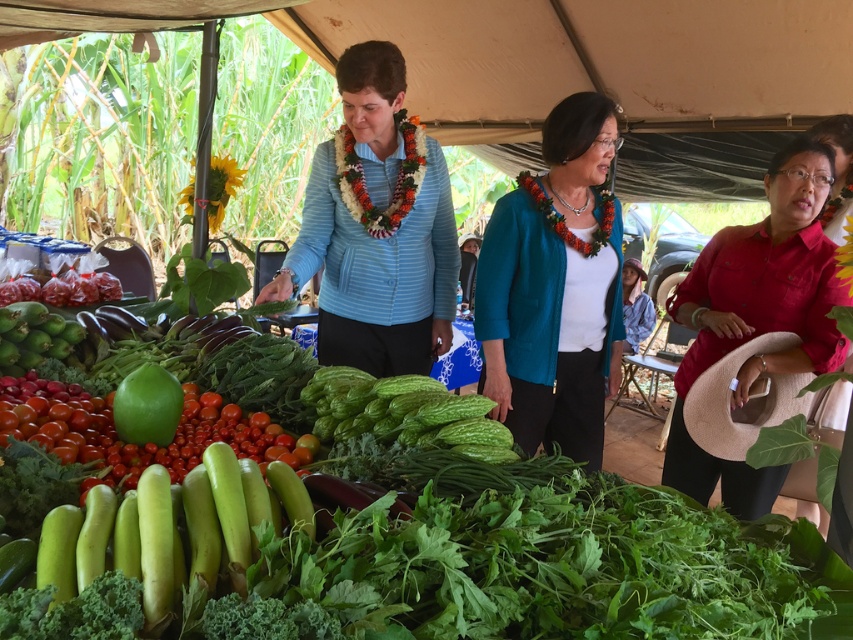
Question: Is red matte shirt at right below green matte melon at center?

Choices:
 (A) no
 (B) yes

Answer: (A)

Question: Which of the following is the farthest from the observer?

Choices:
 (A) red matte shirt at right
 (B) blue striped shirt at center
 (C) teal fabric jacket at center

Answer: (C)

Question: Among these objects, which one is farthest from the camera?

Choices:
 (A) teal fabric jacket at center
 (B) green matte melon at center

Answer: (A)

Question: Which is farther from the teal fabric jacket at center?

Choices:
 (A) red matte shirt at right
 (B) green matte melon at center
 (C) blue striped shirt at center

Answer: (B)

Question: Considering the relative positions of blue striped shirt at center and green matte melon at center in the image provided, where is blue striped shirt at center located with respect to green matte melon at center?

Choices:
 (A) above
 (B) below

Answer: (A)

Question: Does blue striped shirt at center lie behind green matte melon at center?

Choices:
 (A) no
 (B) yes

Answer: (B)